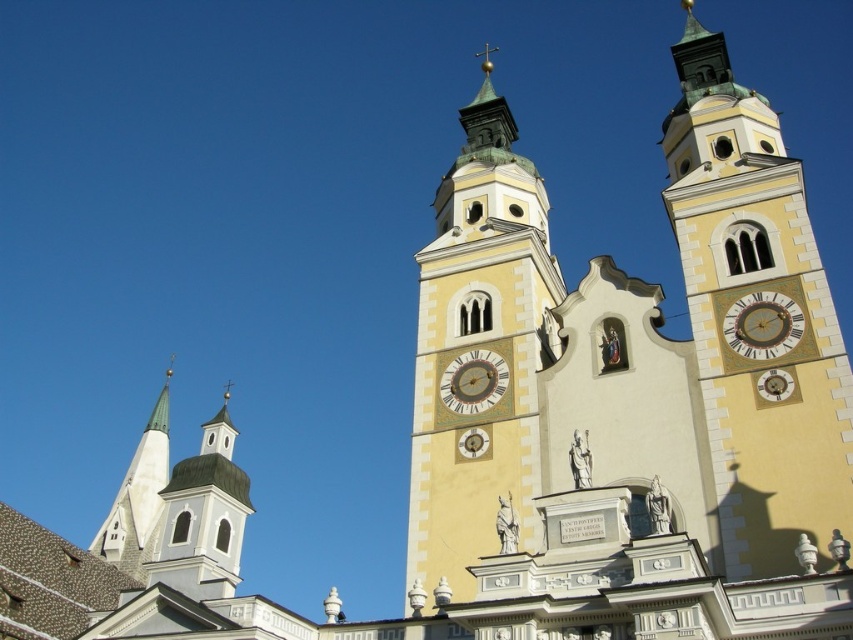
You are standing in front of the church and notice two clocks. The yellow painted stone clock tower at right and the gold metallic clock at center. Which clock is positioned further to the east?

The yellow painted stone clock tower at right is to the right of the gold metallic clock at center. Since the church is oriented with its entrance facing north, the right side would be east. Therefore, the yellow painted stone clock tower at right is positioned further to the east.

You are standing in front of the grand church and want to take a photo of the yellow painted stone clock tower at right. If your camera can focus on objects up to 40 meters away, will you be able to capture a clear image of the tower?

The yellow painted stone clock tower at right is 37.08 meters away from the camera. Since the camera can focus up to 40 meters, it is within range, so yes, you can capture a clear image.